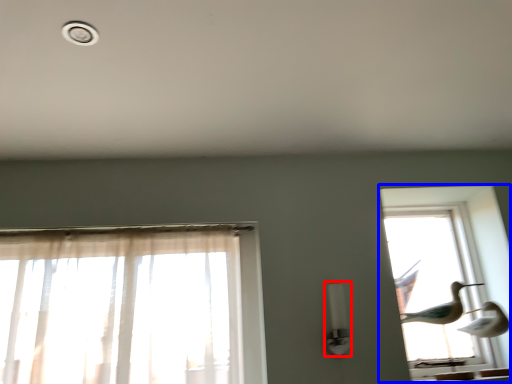
Question: Which of the following is the closest to the observer, light fixture (highlighted by a red box) or window (highlighted by a blue box)?

Choices:
 (A) light fixture
 (B) window

Answer: (A)